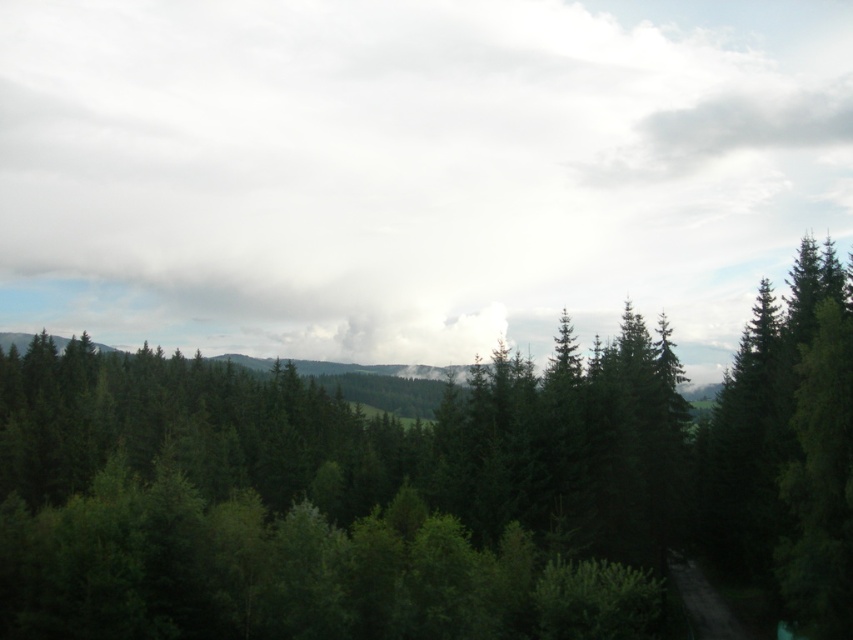
You are a bird soaring above the forest. You see the white fluffy cloud at upper center and the green matte tree at center. Which object is higher in the sky?

The white fluffy cloud at upper center is higher in the sky than the green matte tree at center because it is positioned over the tree.

You are an airplane passenger looking out the window and see the white fluffy cloud at upper center and the green matte tree at center. Which one appears wider from your perspective?

The white fluffy cloud at upper center appears wider than the green matte tree at center because its width is larger according to the description.

You are an observer in the forest looking towards the horizon. You notice a white fluffy cloud at upper center and a green matte tree at center. Which object is positioned to the left when viewing from your perspective?

The white fluffy cloud at upper center is positioned to the left of the green matte tree at center.